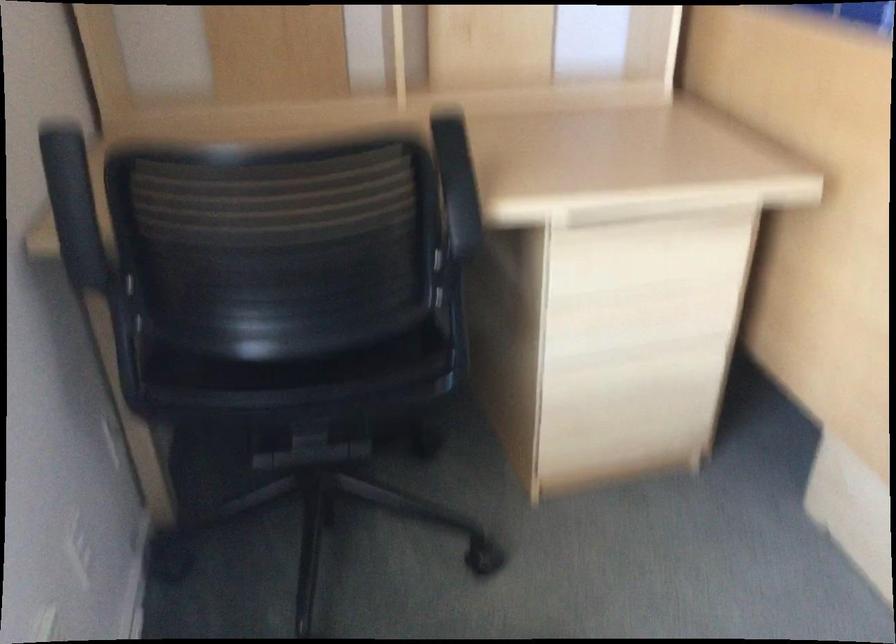
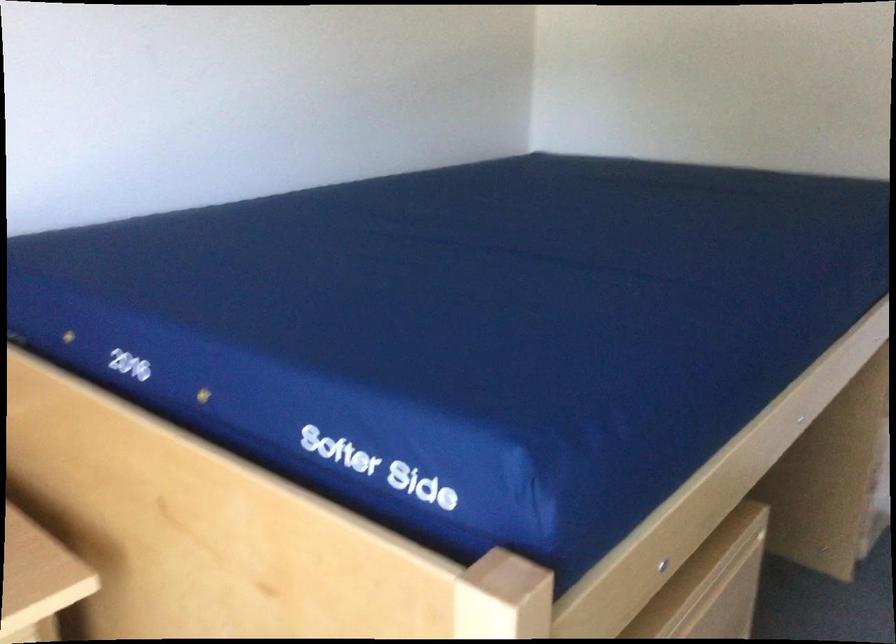
Question: How did the camera likely rotate?

Choices:
 (A) Left
 (B) Right
 (C) Up
 (D) Down

Answer: (B)